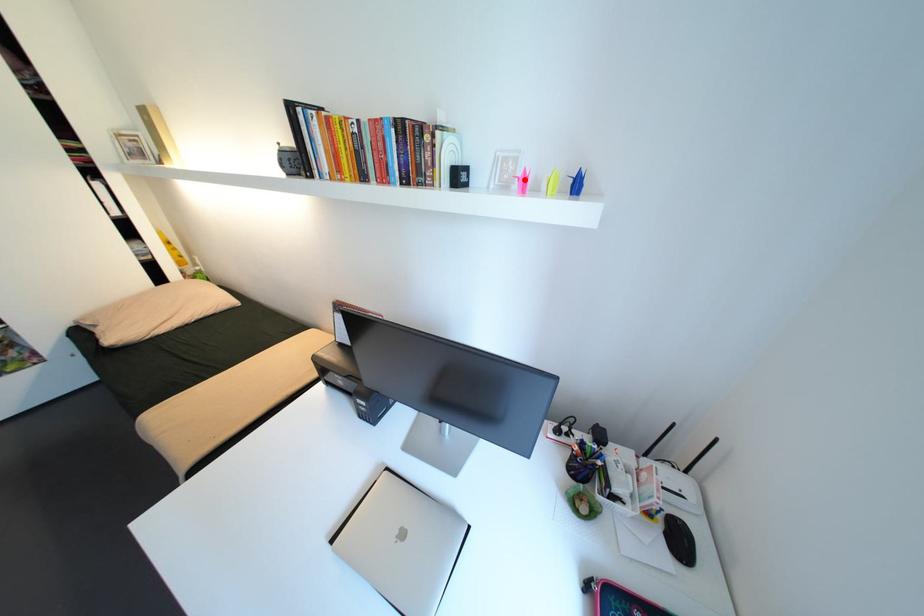
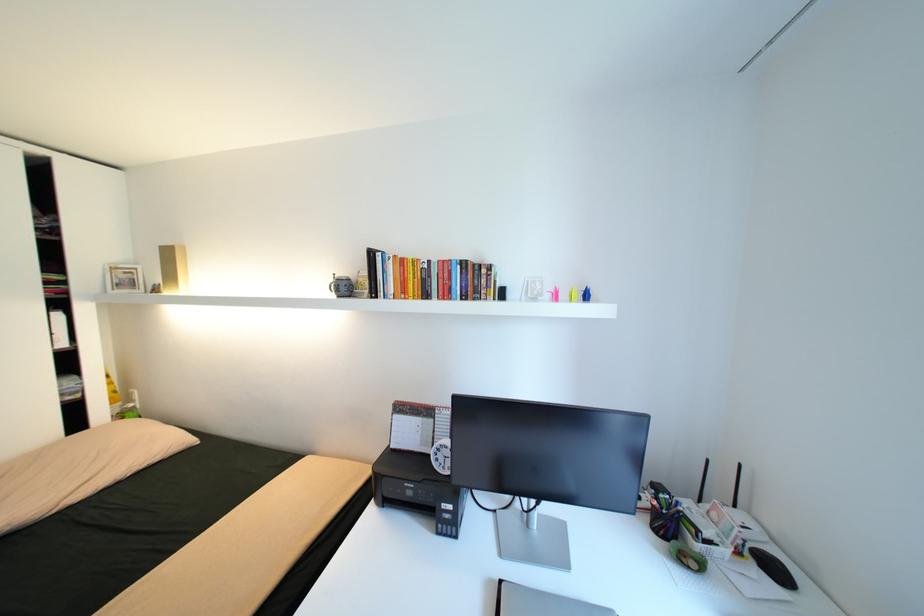
Find the pixel in the second image that matches the highlighted location in the first image.

(558, 294)